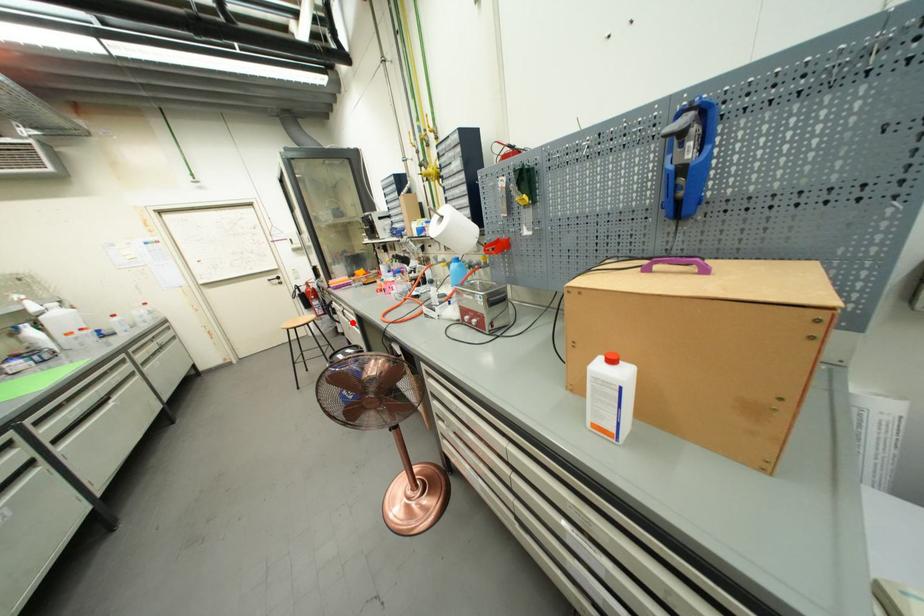
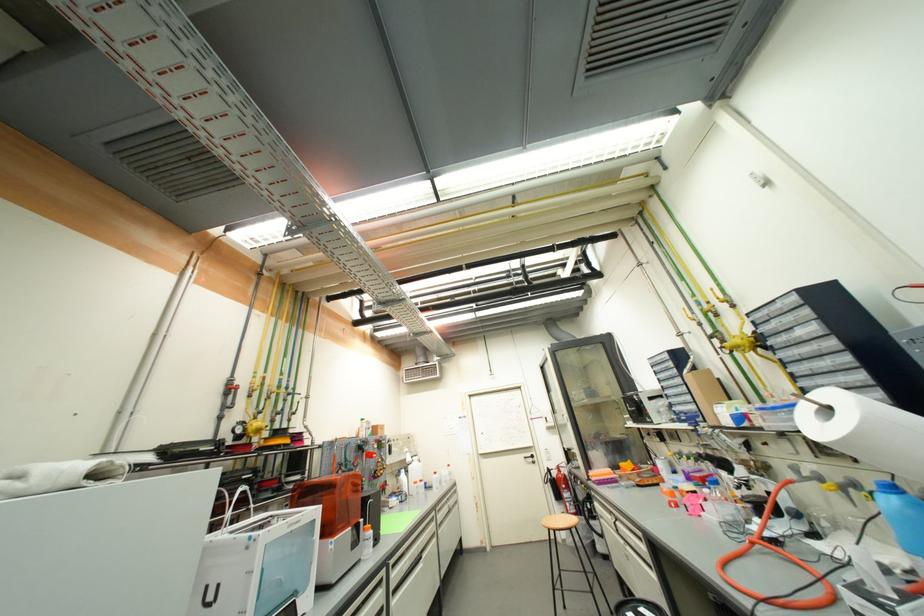
The point at the highlighted location is marked in the first image. Where is the corresponding point in the second image?

(627, 543)